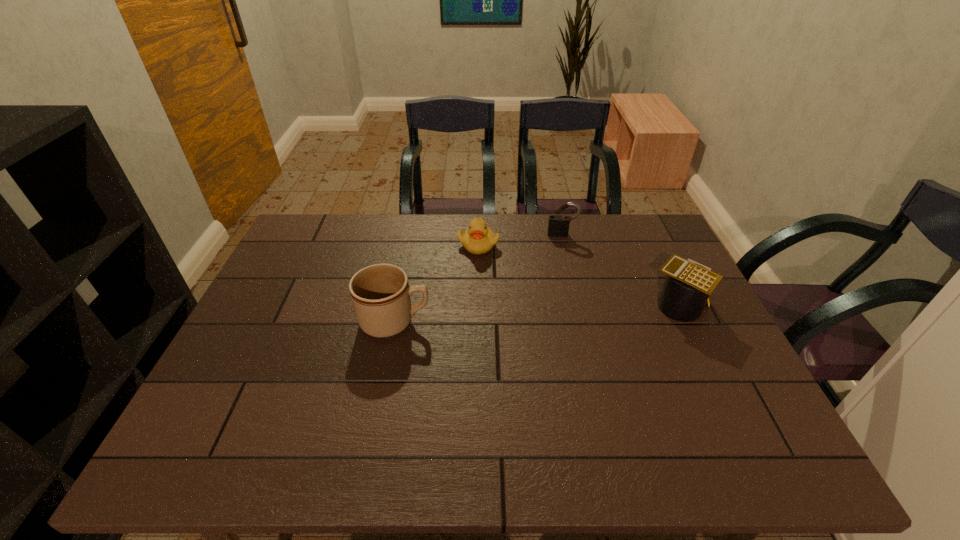
In the image, there is a desktop. At what (x,y) coordinates should I click in order to perform the action: click on free space at the near left corner. Please return your answer as a coordinate pair (x, y). Looking at the image, I should click on (221, 422).

Find the location of a particular element. The height and width of the screenshot is (540, 960). vacant space at the far right corner is located at coordinates (617, 217).

The image size is (960, 540). In order to click on vacant area between the calculator and the padlock in this screenshot , I will do `click(620, 270)`.

Where is `free spot between the duckling and the third object from left to right`? free spot between the duckling and the third object from left to right is located at coordinates (520, 239).

This screenshot has height=540, width=960. Identify the location of free spot between the calculator and the third object from right to left. (579, 275).

Find the location of `vacant space in between the padlock and the rightmost object`. vacant space in between the padlock and the rightmost object is located at coordinates tap(620, 270).

The height and width of the screenshot is (540, 960). I want to click on free point between the leftmost object and the rightmost object, so click(537, 313).

Where is `free space between the padlock and the shortest object`? free space between the padlock and the shortest object is located at coordinates (520, 239).

Locate an element on the screen. The height and width of the screenshot is (540, 960). free area in between the second object from right to left and the third object from right to left is located at coordinates (520, 239).

Identify the location of vacant area that lies between the shortest object and the padlock. (520, 239).